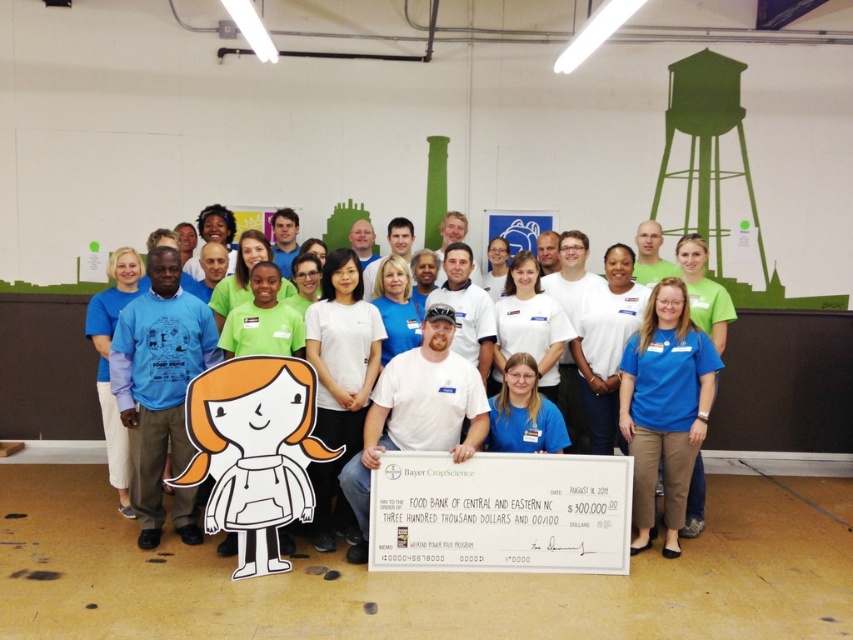
Question: Does blue fabric shirt at center appear on the left side of white paper cutout at center?

Choices:
 (A) yes
 (B) no

Answer: (B)

Question: Is blue fabric shirt at center behind white paper cutout at center?

Choices:
 (A) no
 (B) yes

Answer: (A)

Question: Can you confirm if blue fabric shirt at center is positioned to the left of white paper cutout at center?

Choices:
 (A) no
 (B) yes

Answer: (A)

Question: Among these points, which one is farthest from the camera?

Choices:
 (A) (633, 340)
 (B) (635, 545)

Answer: (A)

Question: Which point appears closest to the camera in this image?

Choices:
 (A) (682, 509)
 (B) (697, 408)

Answer: (B)

Question: Among these objects, which one is farthest from the camera?

Choices:
 (A) white paper cutout at center
 (B) blue fabric shirt at center

Answer: (A)